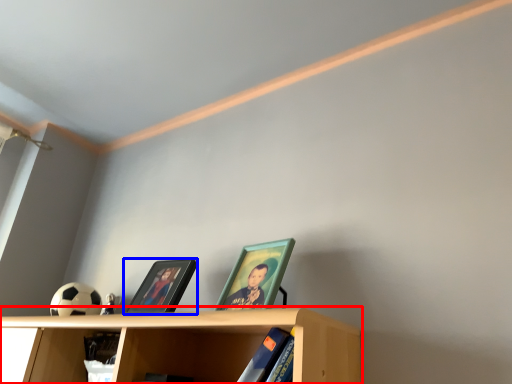
Question: Which object appears closest to the camera in this image, shelf (highlighted by a red box) or picture frame (highlighted by a blue box)?

Choices:
 (A) shelf
 (B) picture frame

Answer: (A)